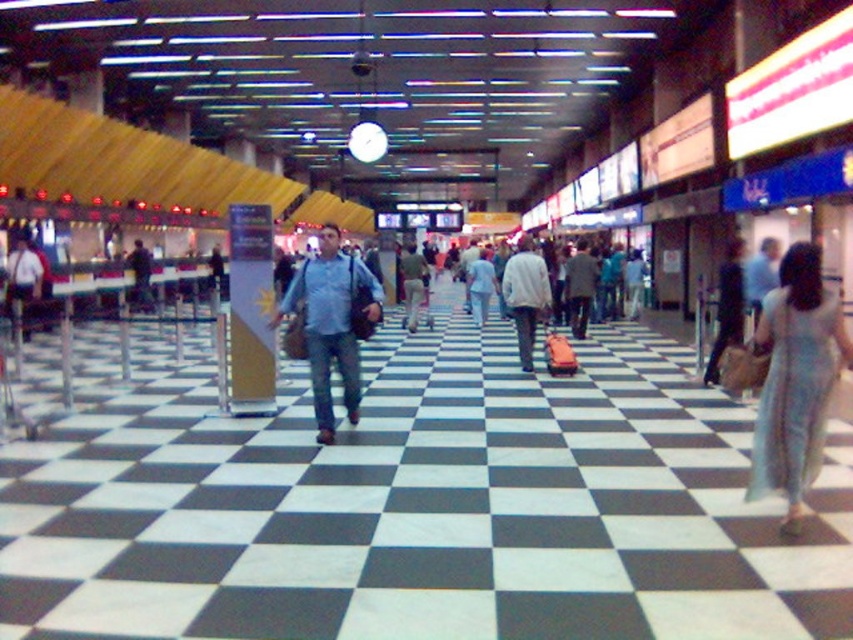
Question: Can you confirm if light gray sweater at center is positioned above light blue denim jeans at center?

Choices:
 (A) no
 (B) yes

Answer: (B)

Question: Which of the following is the closest to the observer?

Choices:
 (A) light blue denim jeans at center
 (B) light gray sweater at center
 (C) matte blue shirt at center
 (D) light blue dress at center

Answer: (D)

Question: Which of these objects is positioned closest to the light gray sweater at center?

Choices:
 (A) matte blue shirt at center
 (B) light blue dress at center
 (C) light blue denim jeans at center

Answer: (C)

Question: Where is light blue dress at center located in relation to light blue denim jeans at center in the image?

Choices:
 (A) above
 (B) below

Answer: (B)

Question: Which object appears farthest from the camera in this image?

Choices:
 (A) light blue denim jeans at center
 (B) matte blue shirt at center

Answer: (A)

Question: Does light blue dress at center lie behind light blue denim jeans at center?

Choices:
 (A) no
 (B) yes

Answer: (A)